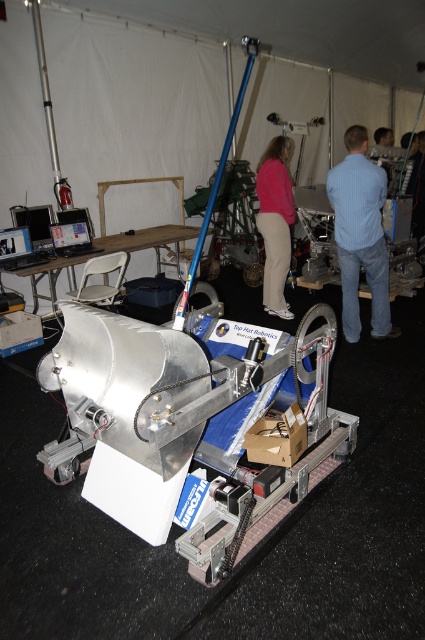
Question: Can you confirm if blue shirt at center is positioned below matte pink sweater at center?

Choices:
 (A) yes
 (B) no

Answer: (A)

Question: Considering the relative positions of blue shirt at center and matte pink sweater at center in the image provided, where is blue shirt at center located with respect to matte pink sweater at center?

Choices:
 (A) below
 (B) above

Answer: (A)

Question: Is blue shirt at center thinner than matte pink sweater at center?

Choices:
 (A) yes
 (B) no

Answer: (B)

Question: Which point is farther from the camera taking this photo?

Choices:
 (A) tap(340, 170)
 (B) tap(269, 177)

Answer: (B)

Question: Which object is farther from the camera taking this photo?

Choices:
 (A) matte pink sweater at center
 (B) blue shirt at center

Answer: (A)